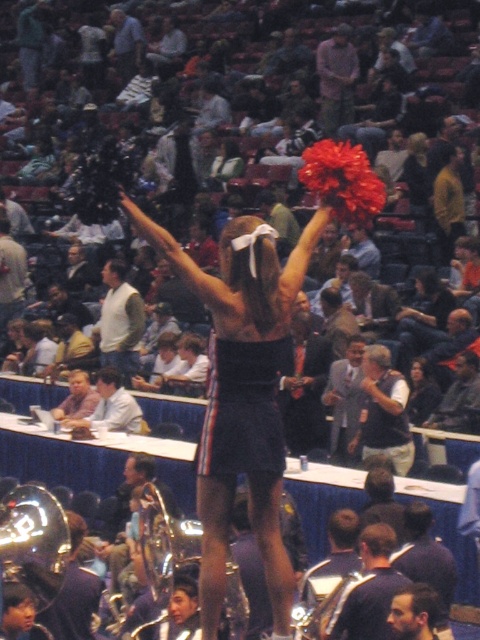
The height and width of the screenshot is (640, 480). What do you see at coordinates (240, 403) in the screenshot?
I see `matte black pom-pom at center` at bounding box center [240, 403].

Is point (212, 305) positioned after point (431, 381)?

No, (212, 305) is in front of (431, 381).

Does point (249, 365) lie in front of point (434, 387)?

Yes, point (249, 365) is closer to viewer.

The width and height of the screenshot is (480, 640). Find the location of `matte black pom-pom at center`. matte black pom-pom at center is located at coordinates (240, 403).

Is gray vest at center taller than white shirt at center?

Yes.

Which is more to the left, gray vest at center or white shirt at center?

From the viewer's perspective, white shirt at center appears more on the left side.

Is point (403, 400) behind point (139, 419)?

That is False.

This screenshot has height=640, width=480. I want to click on gray vest at center, so click(x=384, y=412).

Is matte black pom-pom at center above white shirt at center?

Correct, matte black pom-pom at center is located above white shirt at center.

Does point (206, 550) come in front of point (109, 410)?

Yes, it is in front of point (109, 410).

Image resolution: width=480 pixels, height=640 pixels. I want to click on matte black pom-pom at center, so click(x=240, y=403).